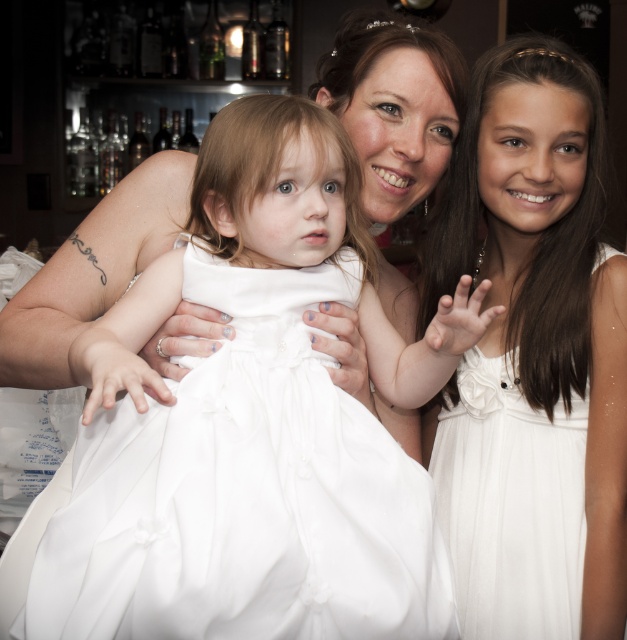
Between white satin dress at center and white satin dress at right, which one is positioned lower?

white satin dress at center

Does white satin dress at center have a greater width compared to white satin dress at right?

Correct, the width of white satin dress at center exceeds that of white satin dress at right.

Locate an element on the screen. Image resolution: width=627 pixels, height=640 pixels. white satin dress at center is located at coordinates (245, 426).